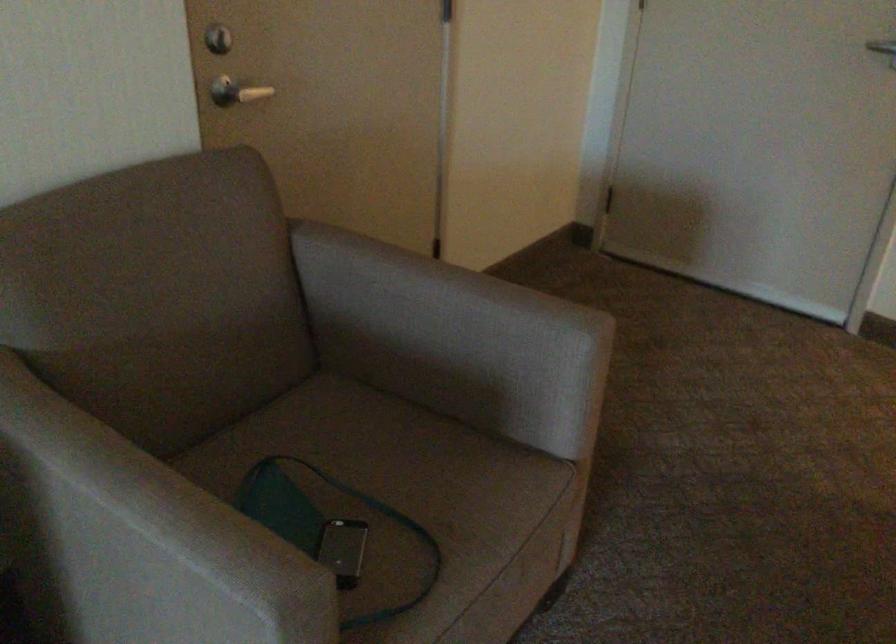
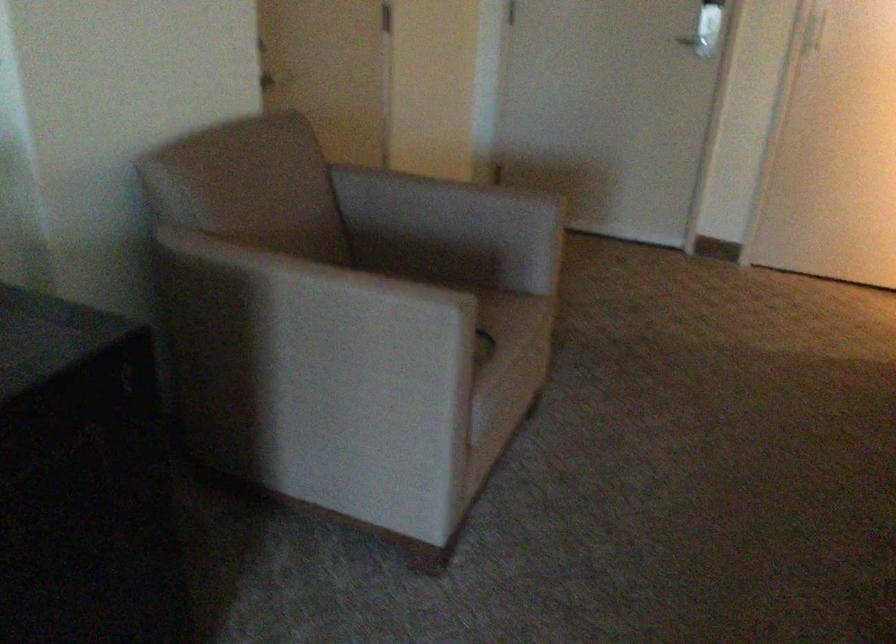
Question: The images are taken continuously from a first-person perspective. In which direction is your viewpoint rotating?

Choices:
 (A) Left
 (B) Right
 (C) Up
 (D) Down

Answer: (B)